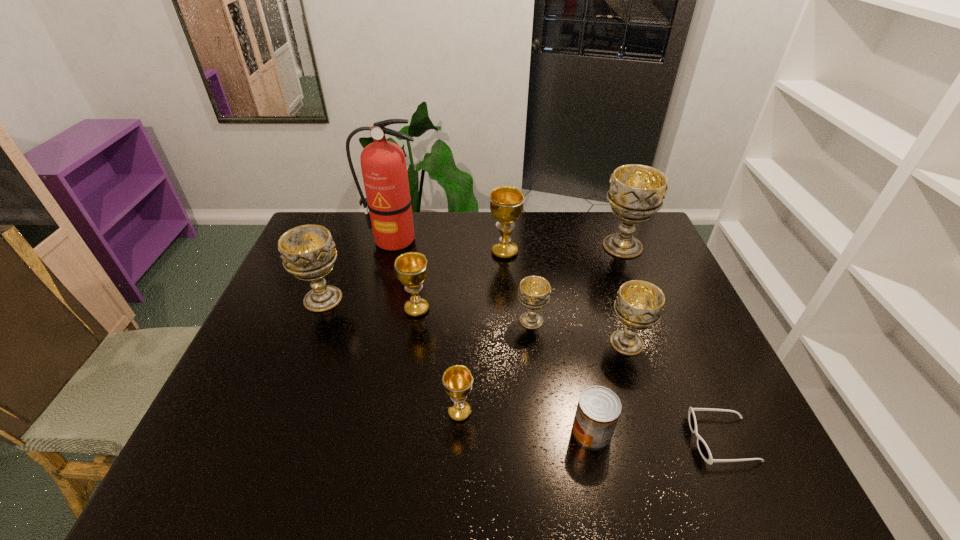
Find the location of a particular element. The width and height of the screenshot is (960, 540). vacant space at the left edge is located at coordinates (337, 265).

Find the location of a particular element. free spot at the right edge of the desktop is located at coordinates (683, 396).

Where is `vacant space at the far left corner`? The height and width of the screenshot is (540, 960). vacant space at the far left corner is located at coordinates (324, 218).

At what (x,y) coordinates should I click in order to perform the action: click on vacant space in between the sunglasses and the fire extinguisher. Please return your answer as a coordinate pair (x, y). The width and height of the screenshot is (960, 540). Looking at the image, I should click on (558, 340).

Identify the location of unoccupied position between the tallest object and the smallest gold chalice. (427, 326).

The image size is (960, 540). Find the location of `vacant area that lies between the tallest chalice and the second chalice from left to right`. vacant area that lies between the tallest chalice and the second chalice from left to right is located at coordinates (519, 278).

I want to click on vacant space that is in between the shortest object and the smallest white chalice, so click(627, 380).

The height and width of the screenshot is (540, 960). Find the location of `empty location between the fire extinguisher and the leftmost white chalice`. empty location between the fire extinguisher and the leftmost white chalice is located at coordinates (358, 269).

You are a GUI agent. You are given a task and a screenshot of the screen. Output one action in this format:
    pyautogui.click(x=<x>, y=<y>)
    Task: Click on the free space between the second tallest object and the ninth tallest object
    
    Given the screenshot: What is the action you would take?
    pyautogui.click(x=607, y=340)

Locate an element on the screen. free space between the shortest object and the second smallest gold chalice is located at coordinates (569, 375).